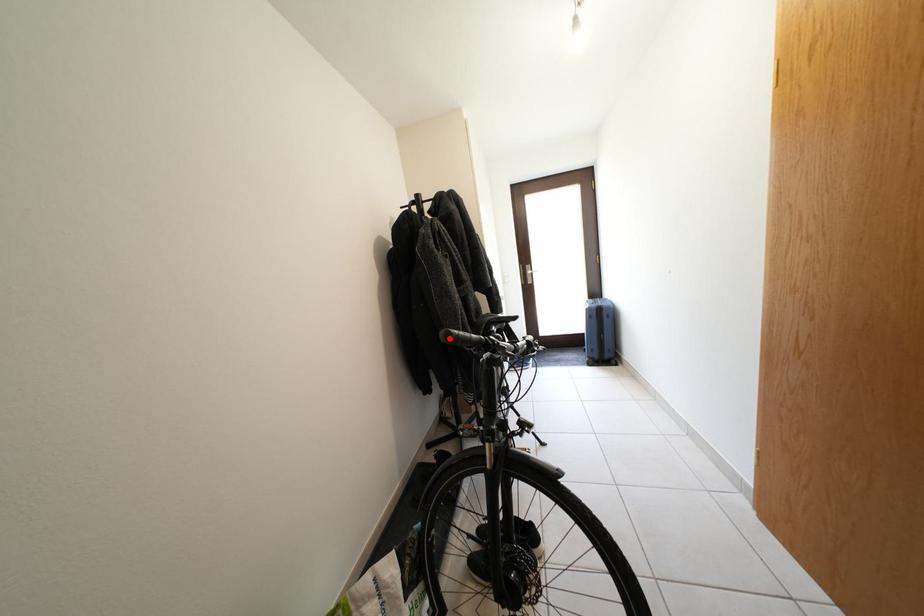
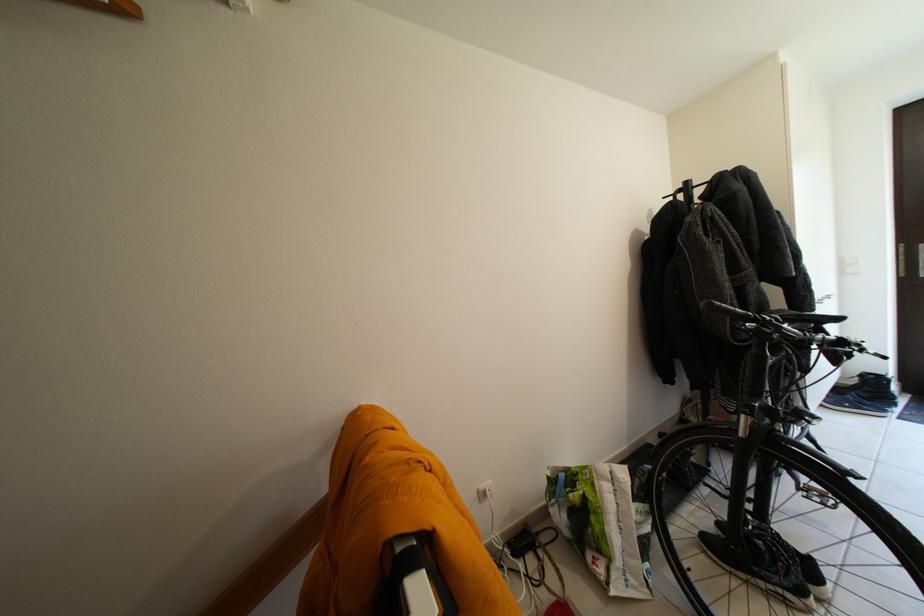
Where in the second image is the point corresponding to the highlighted location from the first image?

(711, 309)